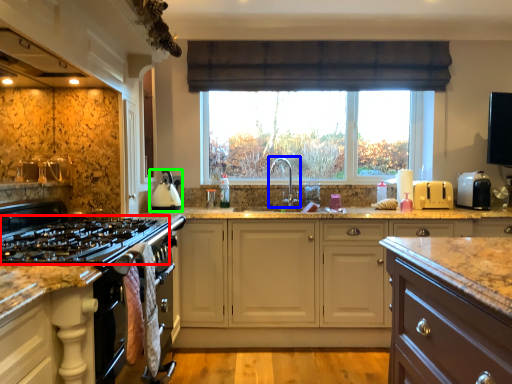
Question: Estimate the real-world distances between objects in this image. Which object is closer to gas stove (highlighted by a red box), tap (highlighted by a blue box) or kitchen appliance (highlighted by a green box)?

Choices:
 (A) tap
 (B) kitchen appliance

Answer: (B)